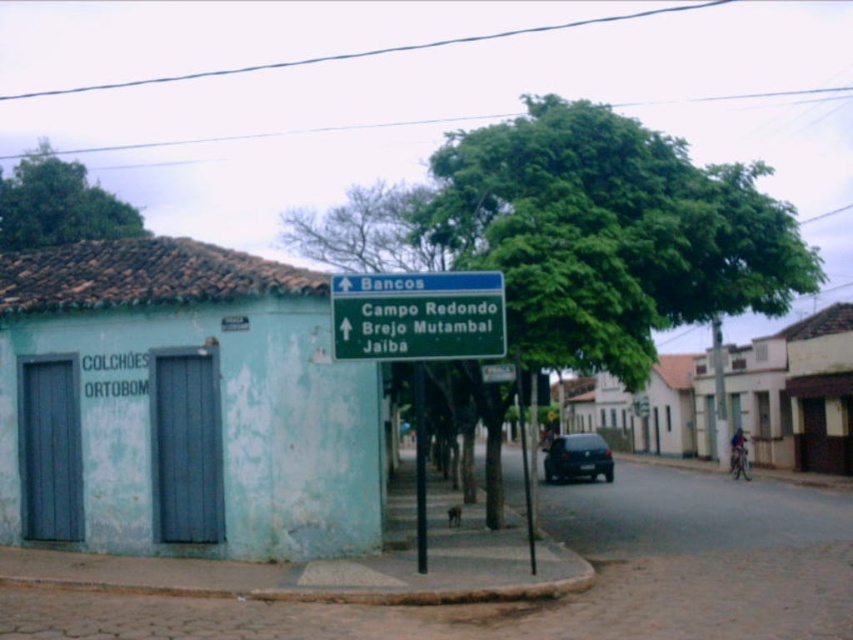
Consider the image. What is the relationship between the width of the shiny black car at center and the green metallic pole at center in the image?

The shiny black car at center is wider than the green metallic pole at center.

What is the relationship between the green leafy tree at center and the green plastic sign at upper center in terms of their positions?

The green leafy tree at center is positioned over the green plastic sign at upper center.